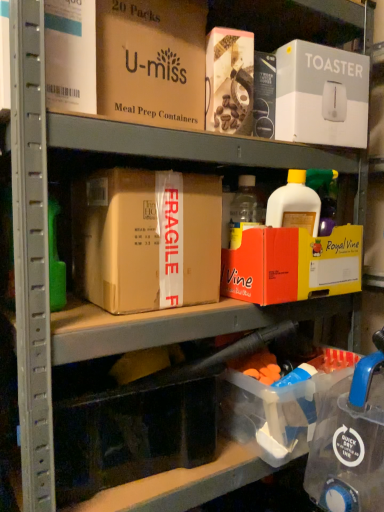
This screenshot has height=512, width=384. What do you see at coordinates (292, 265) in the screenshot?
I see `orange cardboard box at upper center, the fourth box viewed from the top` at bounding box center [292, 265].

Find the location of a particular element. clear plastic storage box at lower right, the second storage box positioned from the left is located at coordinates 282,407.

Find the location of `brown cardboard box at center, the third box positioned from the top`. brown cardboard box at center, the third box positioned from the top is located at coordinates (146, 239).

I want to click on brown cardboard box at upper center, which is counted as the fourth box, starting from the bottom, so pos(151,62).

This screenshot has width=384, height=512. What do you see at coordinates (133, 433) in the screenshot?
I see `transparent plastic storage box at lower center, which ranks as the second storage box in right-to-left order` at bounding box center [133, 433].

Locate an element on the screen. This screenshot has height=512, width=384. white cardboard toaster at upper right, the 3th box positioned from the bottom is located at coordinates (321, 95).

You are a GUI agent. You are given a task and a screenshot of the screen. Output one action in this format:
    pyautogui.click(x=<x>, y=<y>)
    Task: Click on the 1st box in front of the clear plastic storage box at lower right, the second storage box positioned from the left
    The height and width of the screenshot is (512, 384).
    Given the screenshot: What is the action you would take?
    pyautogui.click(x=292, y=265)

Is orange cardboard box at upper center, the fourth box viewed from the top, to the left of clear plastic storage box at lower right, which is counted as the 1th storage box, starting from the right, from the viewer's perspective?

Yes.

Could you tell me if orange cardboard box at upper center, placed as the first box when sorted from bottom to top, is turned towards clear plastic storage box at lower right, which is counted as the 1th storage box, starting from the right?

No, orange cardboard box at upper center, placed as the first box when sorted from bottom to top, is not facing towards clear plastic storage box at lower right, which is counted as the 1th storage box, starting from the right.

How many degrees apart are the facing directions of orange cardboard box at upper center, the fourth box viewed from the top, and clear plastic storage box at lower right, the second storage box positioned from the left?

There is a 83.2-degree angle between the facing directions of orange cardboard box at upper center, the fourth box viewed from the top, and clear plastic storage box at lower right, the second storage box positioned from the left.

Does brown cardboard box at upper center, which is the first box from top to bottom, lie in front of orange cardboard box at upper center, placed as the first box when sorted from bottom to top?

Yes, the depth of brown cardboard box at upper center, which is the first box from top to bottom, is less than that of orange cardboard box at upper center, placed as the first box when sorted from bottom to top.

Is brown cardboard box at upper center, which is counted as the fourth box, starting from the bottom, turned away from orange cardboard box at upper center, placed as the first box when sorted from bottom to top?

brown cardboard box at upper center, which is counted as the fourth box, starting from the bottom, does not have its back to orange cardboard box at upper center, placed as the first box when sorted from bottom to top.

Looking at this image, between brown cardboard box at upper center, which is counted as the fourth box, starting from the bottom, and orange cardboard box at upper center, placed as the first box when sorted from bottom to top, which one has more height?

Standing taller between the two is brown cardboard box at upper center, which is counted as the fourth box, starting from the bottom.

From a real-world perspective, is white cardboard toaster at upper right, the second box in the top-to-bottom sequence, beneath orange cardboard box at upper center, the fourth box viewed from the top?

No, from a real-world perspective, white cardboard toaster at upper right, the second box in the top-to-bottom sequence, is not below orange cardboard box at upper center, the fourth box viewed from the top.

Is white cardboard toaster at upper right, the second box in the top-to-bottom sequence, thinner than orange cardboard box at upper center, the fourth box viewed from the top?

Yes, white cardboard toaster at upper right, the second box in the top-to-bottom sequence, is thinner than orange cardboard box at upper center, the fourth box viewed from the top.

Is white cardboard toaster at upper right, the second box in the top-to-bottom sequence, next to orange cardboard box at upper center, placed as the first box when sorted from bottom to top?

No, white cardboard toaster at upper right, the second box in the top-to-bottom sequence, is not beside orange cardboard box at upper center, placed as the first box when sorted from bottom to top.

Based on the photo, considering the relative positions of white cardboard toaster at upper right, the second box in the top-to-bottom sequence, and orange cardboard box at upper center, placed as the first box when sorted from bottom to top, in the image provided, is white cardboard toaster at upper right, the second box in the top-to-bottom sequence, to the left of orange cardboard box at upper center, placed as the first box when sorted from bottom to top, from the viewer's perspective?

In fact, white cardboard toaster at upper right, the second box in the top-to-bottom sequence, is to the right of orange cardboard box at upper center, placed as the first box when sorted from bottom to top.

Considering the positions of objects brown cardboard box at upper center, which is counted as the fourth box, starting from the bottom, and brown cardboard box at center, the third box positioned from the top, in the image provided, who is more to the left, brown cardboard box at upper center, which is counted as the fourth box, starting from the bottom, or brown cardboard box at center, the third box positioned from the top,?

Positioned to the left is brown cardboard box at upper center, which is counted as the fourth box, starting from the bottom.

How many degrees apart are the facing directions of brown cardboard box at upper center, which is the first box from top to bottom, and brown cardboard box at center, the third box positioned from the top?

0.00396 degrees.

Does brown cardboard box at upper center, which is the first box from top to bottom, touch brown cardboard box at center, marked as the second box in a bottom-to-top arrangement?

No, brown cardboard box at upper center, which is the first box from top to bottom, is not in contact with brown cardboard box at center, marked as the second box in a bottom-to-top arrangement.

From the image's perspective, is brown cardboard box at upper center, which is the first box from top to bottom, located above or below brown cardboard box at center, the third box positioned from the top?

brown cardboard box at upper center, which is the first box from top to bottom, is situated higher than brown cardboard box at center, the third box positioned from the top, in the image.

Does brown cardboard box at center, marked as the second box in a bottom-to-top arrangement, turn towards brown cardboard box at upper center, which is the first box from top to bottom?

No, brown cardboard box at center, marked as the second box in a bottom-to-top arrangement, is not facing towards brown cardboard box at upper center, which is the first box from top to bottom.

Which is further, (92,300) or (205,16)?

The point (205,16) is more distant.

Does brown cardboard box at center, the third box positioned from the top, have a lesser width compared to brown cardboard box at upper center, which is counted as the fourth box, starting from the bottom?

Yes, brown cardboard box at center, the third box positioned from the top, is thinner than brown cardboard box at upper center, which is counted as the fourth box, starting from the bottom.

Measure the distance between brown cardboard box at center, the third box positioned from the top, and brown cardboard box at upper center, which is counted as the fourth box, starting from the bottom.

They are 8.19 inches apart.

Based on their positions, is transparent plastic storage box at lower center, which ranks as the 1th storage box in left-to-right order, located to the left or right of orange cardboard box at upper center, the fourth box viewed from the top?

In the image, transparent plastic storage box at lower center, which ranks as the 1th storage box in left-to-right order, appears on the left side of orange cardboard box at upper center, the fourth box viewed from the top.

Consider the image. What's the angular difference between transparent plastic storage box at lower center, which ranks as the second storage box in right-to-left order, and orange cardboard box at upper center, the fourth box viewed from the top,'s facing directions?

The angle between the facing direction of transparent plastic storage box at lower center, which ranks as the second storage box in right-to-left order, and the facing direction of orange cardboard box at upper center, the fourth box viewed from the top, is 5.36 degrees.

Looking at this image, is transparent plastic storage box at lower center, which ranks as the 1th storage box in left-to-right order, bigger than orange cardboard box at upper center, the fourth box viewed from the top?

Incorrect, transparent plastic storage box at lower center, which ranks as the 1th storage box in left-to-right order, is not larger than orange cardboard box at upper center, the fourth box viewed from the top.

From the image's perspective, between transparent plastic storage box at lower center, which ranks as the second storage box in right-to-left order, and orange cardboard box at upper center, the fourth box viewed from the top, who is located below?

transparent plastic storage box at lower center, which ranks as the second storage box in right-to-left order, appears lower in the image.

Is white cardboard toaster at upper right, the 3th box positioned from the bottom, smaller than clear plastic storage box at lower right, which is counted as the 1th storage box, starting from the right?

No.

From a real-world perspective, is white cardboard toaster at upper right, the second box in the top-to-bottom sequence, on top of clear plastic storage box at lower right, which is counted as the 1th storage box, starting from the right?

Yes, from a real-world perspective, white cardboard toaster at upper right, the second box in the top-to-bottom sequence, is above clear plastic storage box at lower right, which is counted as the 1th storage box, starting from the right.

From a real-world perspective, which box is the 3rd one above the clear plastic storage box at lower right, the second storage box positioned from the left? Please provide its 2D coordinates.

[(321, 95)]

Is point (281, 76) in front of point (276, 400)?

No, it is not.

At what (x,y) coordinates should I click in order to perform the action: click on box that is the 1st one when counting leftward from the clear plastic storage box at lower right, the second storage box positioned from the left. Please return your answer as a coordinate pair (x, y). The width and height of the screenshot is (384, 512). Looking at the image, I should click on 292,265.

Where is `the 1st box behind the brown cardboard box at upper center, which is counted as the fourth box, starting from the bottom, counting from the anchor's position`? The image size is (384, 512). the 1st box behind the brown cardboard box at upper center, which is counted as the fourth box, starting from the bottom, counting from the anchor's position is located at coordinates (292, 265).

Consider the image. Estimate the real-world distances between objects in this image. Which object is closer to brown cardboard box at upper center, which is the first box from top to bottom, clear plastic storage box at lower right, which is counted as the 1th storage box, starting from the right, or brown cardboard box at center, marked as the second box in a bottom-to-top arrangement?

The object closer to brown cardboard box at upper center, which is the first box from top to bottom, is brown cardboard box at center, marked as the second box in a bottom-to-top arrangement.

Looking at the image, which one is located further to brown cardboard box at center, marked as the second box in a bottom-to-top arrangement, white cardboard toaster at upper right, the 3th box positioned from the bottom, or clear plastic storage box at lower right, which is counted as the 1th storage box, starting from the right?

The object further to brown cardboard box at center, marked as the second box in a bottom-to-top arrangement, is white cardboard toaster at upper right, the 3th box positioned from the bottom.

When comparing their distances from brown cardboard box at upper center, which is the first box from top to bottom, does orange cardboard box at upper center, the fourth box viewed from the top, or clear plastic storage box at lower right, which is counted as the 1th storage box, starting from the right, seem closer?

orange cardboard box at upper center, the fourth box viewed from the top, is positioned closer to the anchor brown cardboard box at upper center, which is the first box from top to bottom.

When comparing their distances from white cardboard toaster at upper right, the second box in the top-to-bottom sequence, does clear plastic storage box at lower right, the second storage box positioned from the left, or orange cardboard box at upper center, the fourth box viewed from the top, seem further?

Among the two, clear plastic storage box at lower right, the second storage box positioned from the left, is located further to white cardboard toaster at upper right, the second box in the top-to-bottom sequence.

From the image, which object appears to be nearer to brown cardboard box at upper center, which is counted as the fourth box, starting from the bottom, brown cardboard box at center, the third box positioned from the top, or orange cardboard box at upper center, placed as the first box when sorted from bottom to top?

Based on the image, brown cardboard box at center, the third box positioned from the top, appears to be nearer to brown cardboard box at upper center, which is counted as the fourth box, starting from the bottom.

Looking at the image, which one is located closer to brown cardboard box at upper center, which is counted as the fourth box, starting from the bottom, white cardboard toaster at upper right, the 3th box positioned from the bottom, or transparent plastic storage box at lower center, which ranks as the 1th storage box in left-to-right order?

white cardboard toaster at upper right, the 3th box positioned from the bottom, is closer to brown cardboard box at upper center, which is counted as the fourth box, starting from the bottom.

From the image, which object appears to be farther from clear plastic storage box at lower right, the second storage box positioned from the left, white cardboard toaster at upper right, the second box in the top-to-bottom sequence, or orange cardboard box at upper center, placed as the first box when sorted from bottom to top?

The object further to clear plastic storage box at lower right, the second storage box positioned from the left, is white cardboard toaster at upper right, the second box in the top-to-bottom sequence.

Considering their positions, is clear plastic storage box at lower right, which is counted as the 1th storage box, starting from the right, positioned further to brown cardboard box at center, marked as the second box in a bottom-to-top arrangement, than brown cardboard box at upper center, which is counted as the fourth box, starting from the bottom?

clear plastic storage box at lower right, which is counted as the 1th storage box, starting from the right, is positioned further to the anchor brown cardboard box at center, marked as the second box in a bottom-to-top arrangement.

The image size is (384, 512). I want to click on storage box between white cardboard toaster at upper right, the second box in the top-to-bottom sequence, and clear plastic storage box at lower right, the second storage box positioned from the left, from top to bottom, so click(133, 433).

Locate an element on the screen. storage box between brown cardboard box at center, marked as the second box in a bottom-to-top arrangement, and clear plastic storage box at lower right, which is counted as the 1th storage box, starting from the right, in the vertical direction is located at coordinates (133, 433).

This screenshot has width=384, height=512. Find the location of `box between brown cardboard box at center, marked as the second box in a bottom-to-top arrangement, and clear plastic storage box at lower right, which is counted as the 1th storage box, starting from the right, in the up-down direction`. box between brown cardboard box at center, marked as the second box in a bottom-to-top arrangement, and clear plastic storage box at lower right, which is counted as the 1th storage box, starting from the right, in the up-down direction is located at coordinates (292, 265).

Where is `box that lies between brown cardboard box at center, the third box positioned from the top, and transparent plastic storage box at lower center, which ranks as the second storage box in right-to-left order, from top to bottom`? Image resolution: width=384 pixels, height=512 pixels. box that lies between brown cardboard box at center, the third box positioned from the top, and transparent plastic storage box at lower center, which ranks as the second storage box in right-to-left order, from top to bottom is located at coordinates (292, 265).